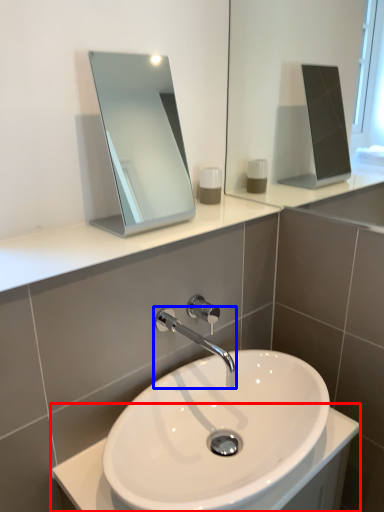
Question: Which object is further to the camera taking this photo, counter top (highlighted by a red box) or tap (highlighted by a blue box)?

Choices:
 (A) counter top
 (B) tap

Answer: (B)